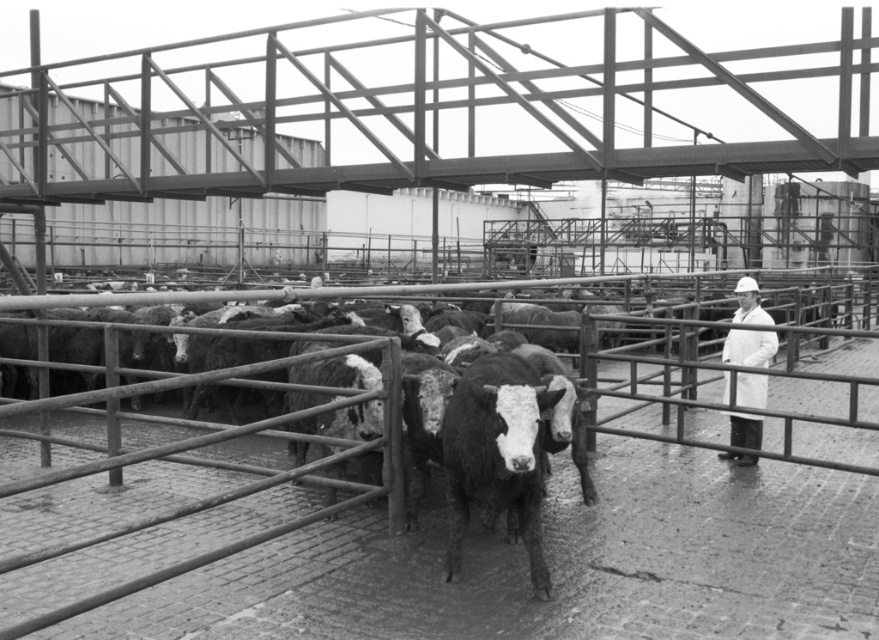
Question: Is black and white textured bull at center smaller than white lab coat at center?

Choices:
 (A) no
 (B) yes

Answer: (B)

Question: Does black and white textured bull at center have a greater width compared to white lab coat at center?

Choices:
 (A) no
 (B) yes

Answer: (A)

Question: Which of the following is the closest to the observer?

Choices:
 (A) (752, 317)
 (B) (462, 413)

Answer: (B)

Question: Is black and white textured bull at center to the left of white lab coat at center from the viewer's perspective?

Choices:
 (A) yes
 (B) no

Answer: (A)